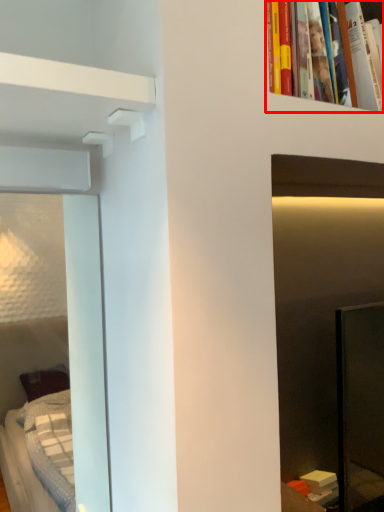
Question: Observing the image, what is the correct spatial positioning of book (annotated by the red box) in reference to shelf?

Choices:
 (A) right
 (B) left

Answer: (A)